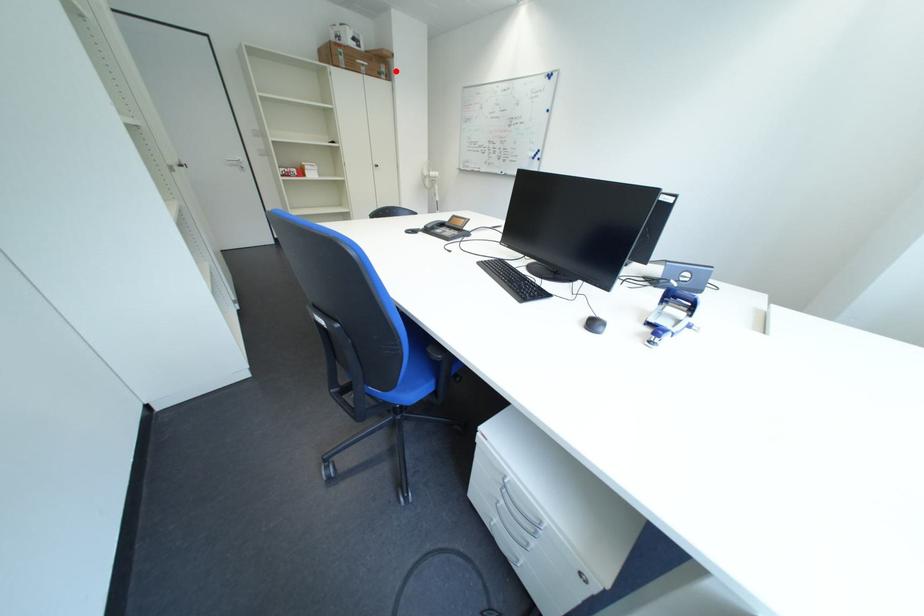
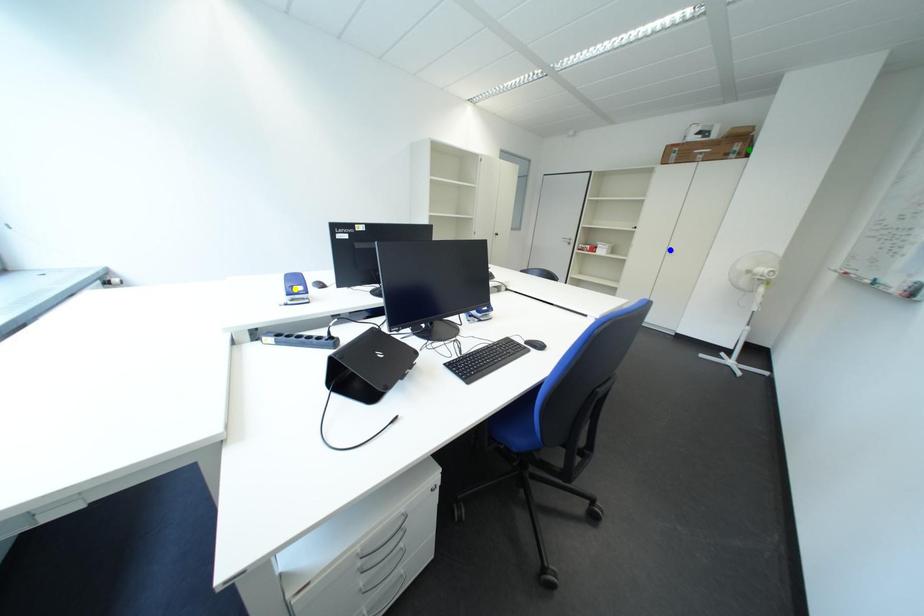
Question: I am providing you with two images of the same scene from different viewpoints. A red point is marked on the first image. You are given multiple points on the second image. Which spot in image 2 lines up with the point in image 1?

Choices:
 (A) blue point
 (B) yellow point
 (C) green point

Answer: (C)